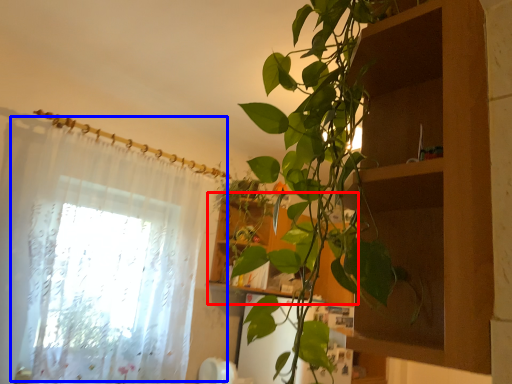
Question: Which object appears closest to the camera in this image, cabinet (highlighted by a red box) or curtain (highlighted by a blue box)?

Choices:
 (A) cabinet
 (B) curtain

Answer: (B)